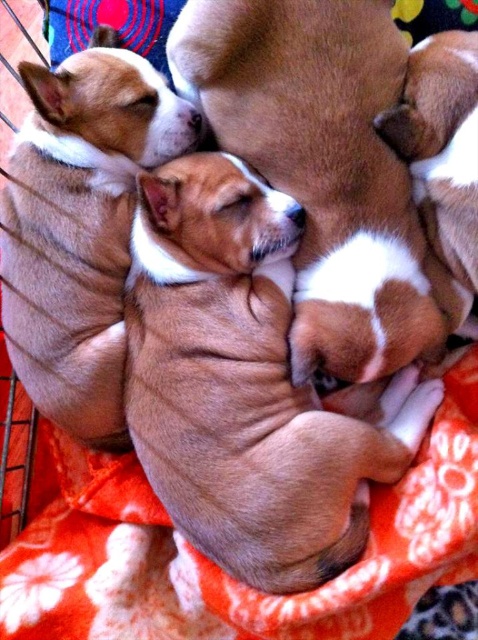
You are a photographer trying to capture the two puppies in the image. You want to ensure that both the brown furry dog at center and the smooth brown puppy at center are clearly visible in your shot. Based on their positions, which puppy is located to the left?

The smooth brown puppy at center is located to the left because the brown furry dog at center is positioned on the right side of it.

You are a dog owner who wants to ensure both puppies have enough space to sleep comfortably. Given that the blanket is 1 meter wide, can both the brown furry dog at center and the smooth brown puppy at center fit side by side on the blanket without overlapping?

The brown furry dog at center is bigger than the smooth brown puppy at center. Since the blanket is 1 meter wide, it depends on their combined widths. However, since the exact sizes aren

You are a photographer trying to capture the two puppies in the image. You want to ensure that both the brown furry dog at center and the brown soft fur at upper right are clearly visible in your shot. Based on their positions, which puppy should you focus on first to ensure both are in focus?

The brown furry dog at center is above the brown soft fur at upper right, so focusing on the brown furry dog at center first will help ensure both are in focus as they are layered.